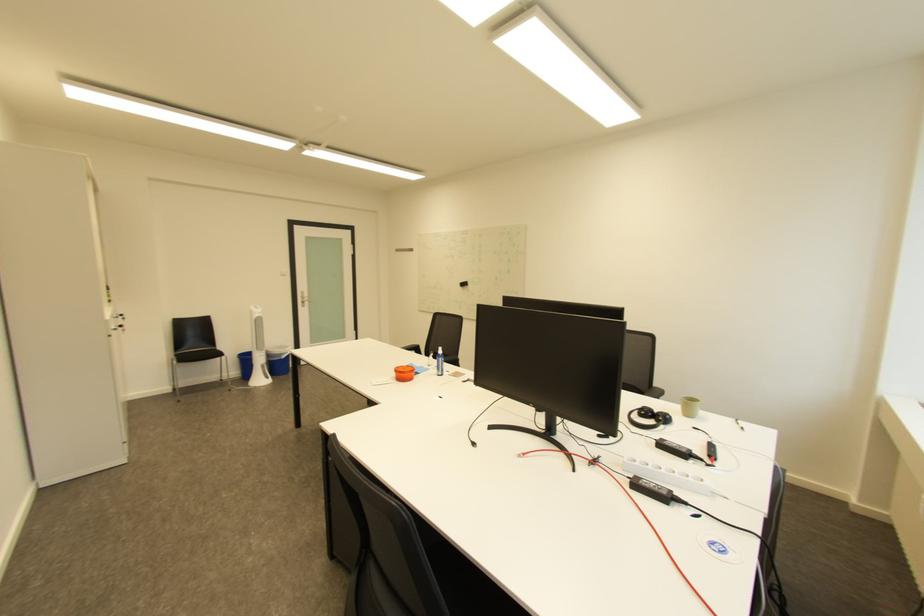
The height and width of the screenshot is (616, 924). Describe the element at coordinates (439, 361) in the screenshot. I see `a blue spray bottle` at that location.